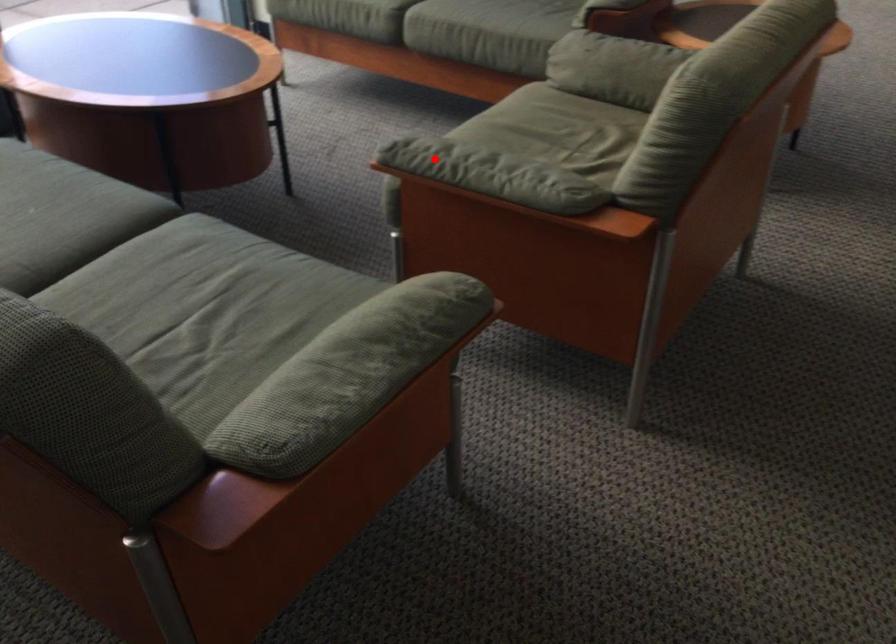
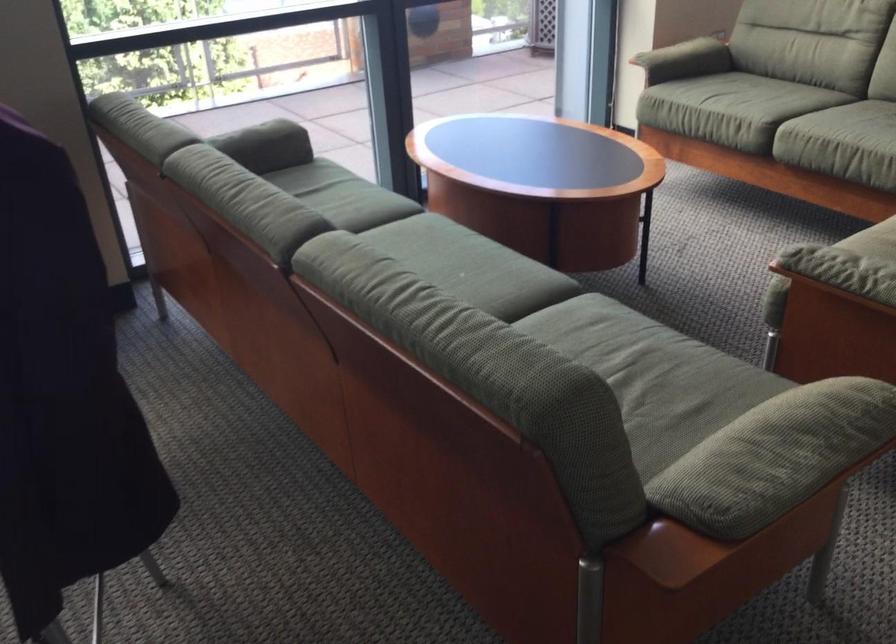
Find the pixel in the second image that matches the highlighted location in the first image.

(834, 263)